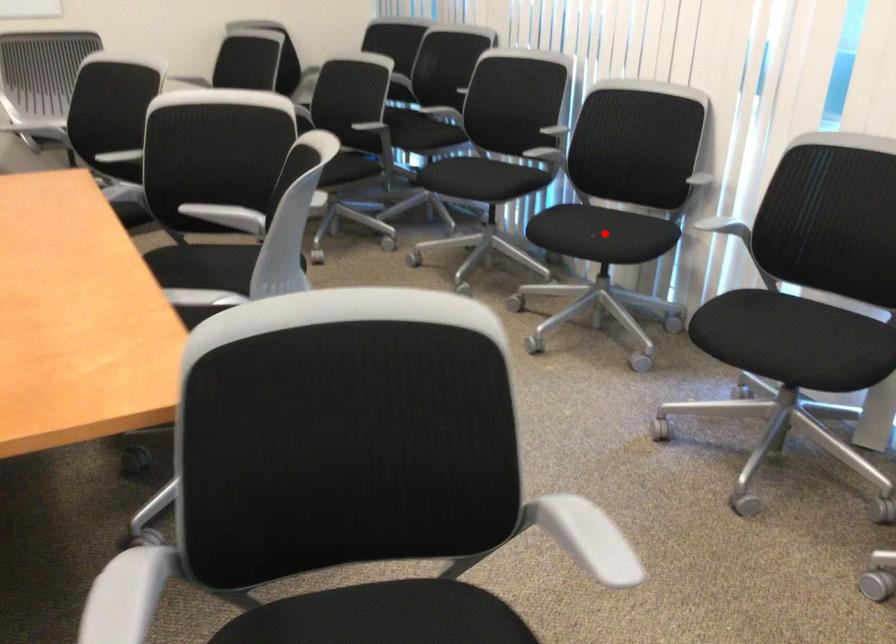
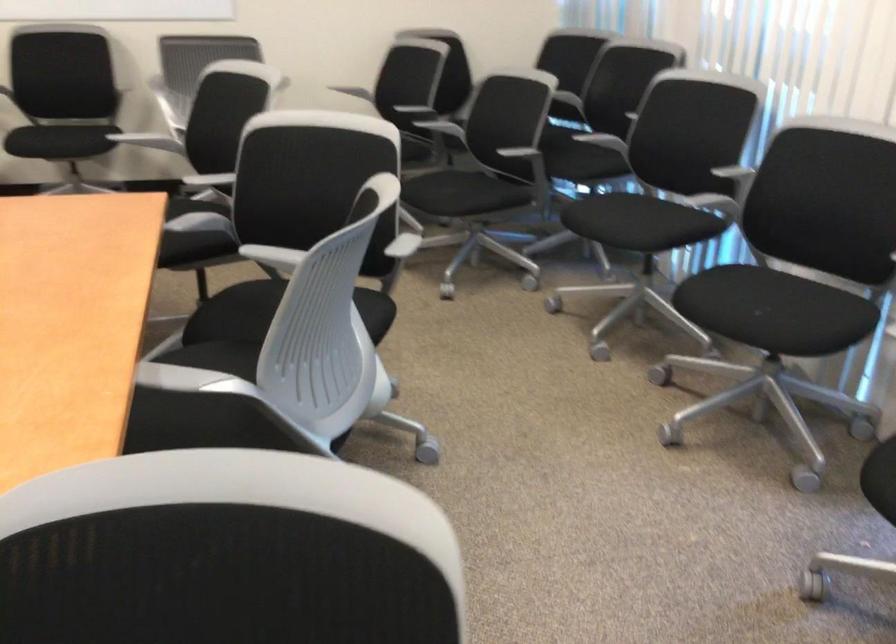
Question: A red point is marked in image1. In image2, is the corresponding 3D point closer to the camera or farther? Reply with the corresponding letter.

Choices:
 (A) The corresponding 3D point is closer.
 (B) The corresponding 3D point is farther.

Answer: (A)